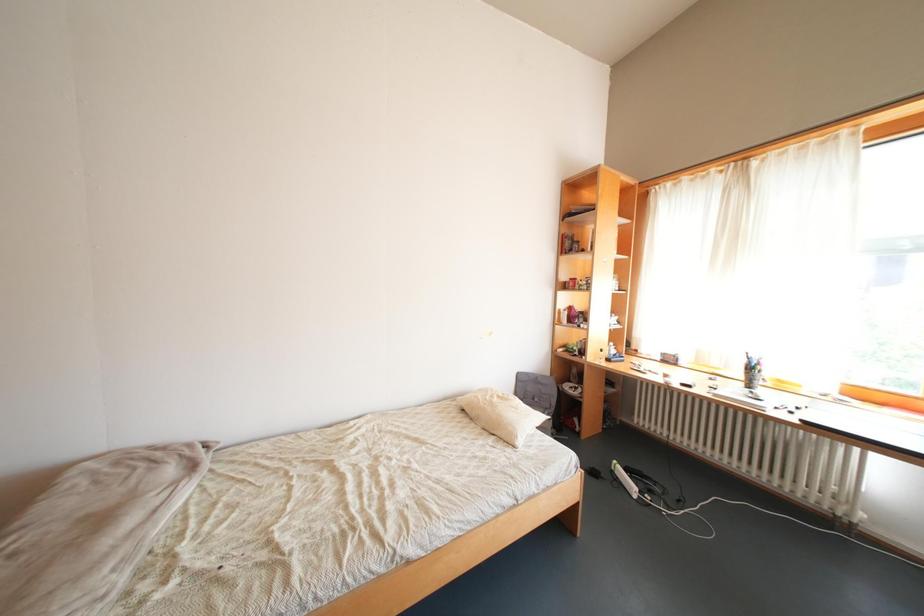
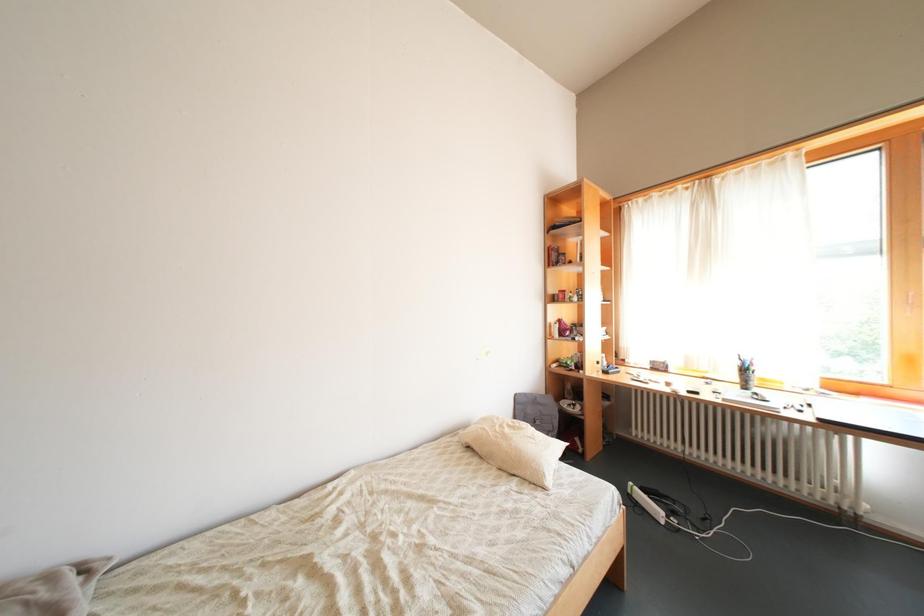
Question: Based on the continuous images, in which direction is the camera rotating? Reply with the corresponding letter.

Choices:
 (A) Left
 (B) Right
 (C) Up
 (D) Down

Answer: (B)